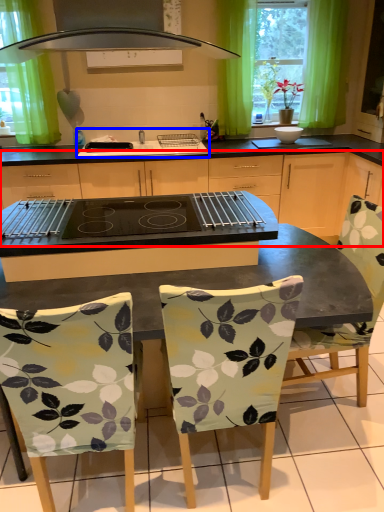
Question: Among these objects, which one is nearest to the camera, cabinetry (highlighted by a red box) or sink (highlighted by a blue box)?

Choices:
 (A) cabinetry
 (B) sink

Answer: (A)